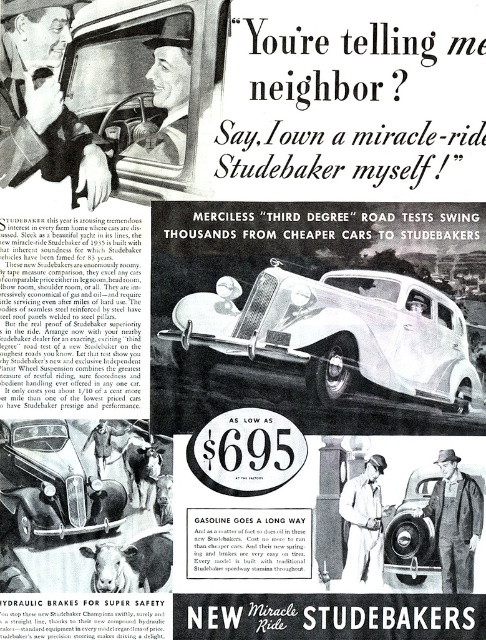
Does matte black hat at upper center appear under overalls at lower right?

No.

Who is more forward, (187,61) or (444,573)?

Point (187,61)

Is point (159, 74) farther from camera compared to point (468, 577)?

No, it is in front of (468, 577).

Find the location of a particular element. This screenshot has width=486, height=640. matte black hat at upper center is located at coordinates (168, 92).

Is smooth leather glove at upper left bigger than shiny silver car at lower left?

Yes, smooth leather glove at upper left is bigger than shiny silver car at lower left.

Does smooth leather glove at upper left appear under shiny silver car at lower left?

No.

This screenshot has height=640, width=486. I want to click on smooth leather glove at upper left, so click(44, 109).

Who is shorter, smooth leather glove at upper left or matte black hat at upper center?

matte black hat at upper center

Who is more forward, (x=56, y=161) or (x=156, y=160)?

Point (x=156, y=160) is in front.

Find the location of a particular element. The image size is (486, 640). smooth leather glove at upper left is located at coordinates (44, 109).